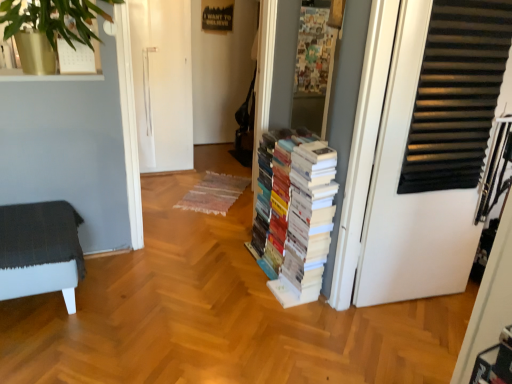
Identify the location of vacant location below dark gray fabric ottoman at left (from a real-world perspective). The width and height of the screenshot is (512, 384). point(33,310).